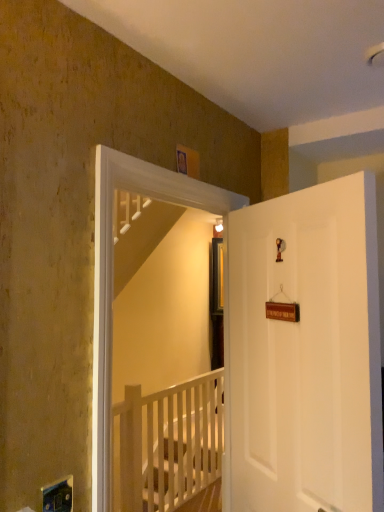
Measure the distance between point (376, 420) and camera.

The depth of point (376, 420) is 1.13 meters.

Where is `white wooden rail at center`? white wooden rail at center is located at coordinates (167, 444).

How many degrees apart are the facing directions of white wooden rail at center and white wooden screen door at upper center?

2.16 degrees separate the facing orientations of white wooden rail at center and white wooden screen door at upper center.

Measure the distance between white wooden rail at center and white wooden screen door at upper center.

white wooden rail at center is 1.73 meters away from white wooden screen door at upper center.

Consider the image. From a real-world perspective, which is physically below, white wooden rail at center or white wooden screen door at upper center?

In real-world perspective, white wooden rail at center is lower.

From the image's perspective, between white wooden rail at center and white wooden screen door at upper center, who is located below?

white wooden rail at center appears lower in the image.

Is white wooden screen door at upper center to the left or to the right of white wooden rail at center in the image?

Clearly, white wooden screen door at upper center is on the right of white wooden rail at center in the image.

In terms of width, does white wooden screen door at upper center look wider or thinner when compared to white wooden rail at center?

Considering their sizes, white wooden screen door at upper center looks slimmer than white wooden rail at center.

Which is in front, white wooden screen door at upper center or white wooden rail at center?

white wooden screen door at upper center is closer to the camera.

Between white wooden screen door at upper center and white wooden rail at center, which one has larger size?

white wooden rail at center.

Is white wooden screen door at upper center bigger or smaller than white matte door at right?

Clearly, white wooden screen door at upper center is smaller in size than white matte door at right.

Is white wooden screen door at upper center inside or outside of white matte door at right?

white wooden screen door at upper center lies outside white matte door at right.

Which object is closer to the camera, white wooden screen door at upper center or white matte door at right?

white matte door at right is in front.

Is white wooden screen door at upper center not near white matte door at right?

No.

In the scene shown: Is white matte door at right placed right next to white wooden rail at center?

They are not placed beside each other.

Is point (232, 309) more distant than point (176, 479)?

That is False.

Is white matte door at right aimed at white wooden rail at center?

No, white matte door at right is not aimed at white wooden rail at center.

In the scene shown: From a real-world perspective, between white wooden rail at center and white matte door at right, who is vertically higher?

From a 3D spatial view, white matte door at right is above.

Based on the photo, from their relative heights in the image, would you say white wooden rail at center is taller or shorter than white matte door at right?

Clearly, white wooden rail at center is shorter compared to white matte door at right.

Is white wooden rail at center next to white matte door at right and touching it?

No, white wooden rail at center is not making contact with white matte door at right.

Which point is more forward, (138, 507) or (303, 326)?

The point (303, 326) is closer to the camera.

Considering the relative positions of white matte door at right and white wooden screen door at upper center in the image provided, is white matte door at right to the left of white wooden screen door at upper center from the viewer's perspective?

No.

Which object is thinner, white matte door at right or white wooden screen door at upper center?

white wooden screen door at upper center.

Can you see white matte door at right touching white wooden screen door at upper center?

No, white matte door at right is not touching white wooden screen door at upper center.

Would you say white matte door at right is inside or outside white wooden screen door at upper center?

white matte door at right lies outside white wooden screen door at upper center.

Where is `screen door lying above the white wooden rail at center (from the image's perspective)`? Image resolution: width=384 pixels, height=512 pixels. screen door lying above the white wooden rail at center (from the image's perspective) is located at coordinates (112, 280).

Locate an element on the screen. rail lying below the white wooden screen door at upper center (from the image's perspective) is located at coordinates (167, 444).

Which object lies nearer to the anchor point white wooden screen door at upper center, white wooden rail at center or white matte door at right?

white matte door at right.

From the image, which object appears to be nearer to white wooden rail at center, white matte door at right or white wooden screen door at upper center?

The object closer to white wooden rail at center is white matte door at right.

Estimate the real-world distances between objects in this image. Which object is further from white wooden rail at center, white wooden screen door at upper center or white matte door at right?

white wooden screen door at upper center is further to white wooden rail at center.

When comparing their distances from white wooden screen door at upper center, does white matte door at right or white wooden rail at center seem further?

white wooden rail at center lies further to white wooden screen door at upper center than the other object.

Estimate the real-world distances between objects in this image. Which object is closer to white matte door at right, white wooden rail at center or white wooden screen door at upper center?

The object closer to white matte door at right is white wooden screen door at upper center.

Based on the photo, when comparing their distances from white matte door at right, does white wooden screen door at upper center or white wooden rail at center seem further?

Based on the image, white wooden rail at center appears to be further to white matte door at right.

Identify the location of screen door between white matte door at right and white wooden rail at center from front to back. (112, 280).